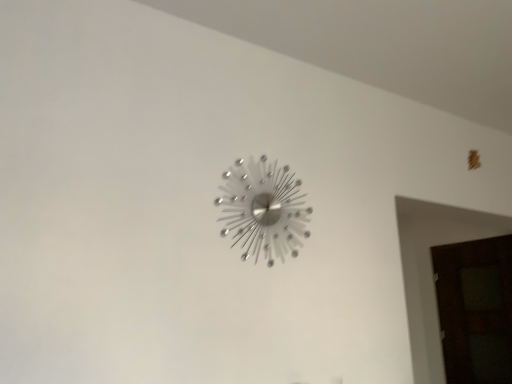
Question: Is dark wood door at right bigger or smaller than silver metallic wall clock at center?

Choices:
 (A) small
 (B) big

Answer: (B)

Question: In terms of width, does dark wood door at right look wider or thinner when compared to silver metallic wall clock at center?

Choices:
 (A) wide
 (B) thin

Answer: (A)

Question: Considering the positions of point (486, 312) and point (274, 231), is point (486, 312) closer or farther from the camera than point (274, 231)?

Choices:
 (A) closer
 (B) farther

Answer: (B)

Question: From the image's perspective, is silver metallic wall clock at center above or below dark wood door at right?

Choices:
 (A) above
 (B) below

Answer: (A)

Question: Does point (262, 170) appear closer or farther from the camera than point (495, 249)?

Choices:
 (A) closer
 (B) farther

Answer: (A)

Question: Looking at the image, does silver metallic wall clock at center seem bigger or smaller compared to dark wood door at right?

Choices:
 (A) big
 (B) small

Answer: (B)

Question: Is silver metallic wall clock at center taller or shorter than dark wood door at right?

Choices:
 (A) short
 (B) tall

Answer: (A)